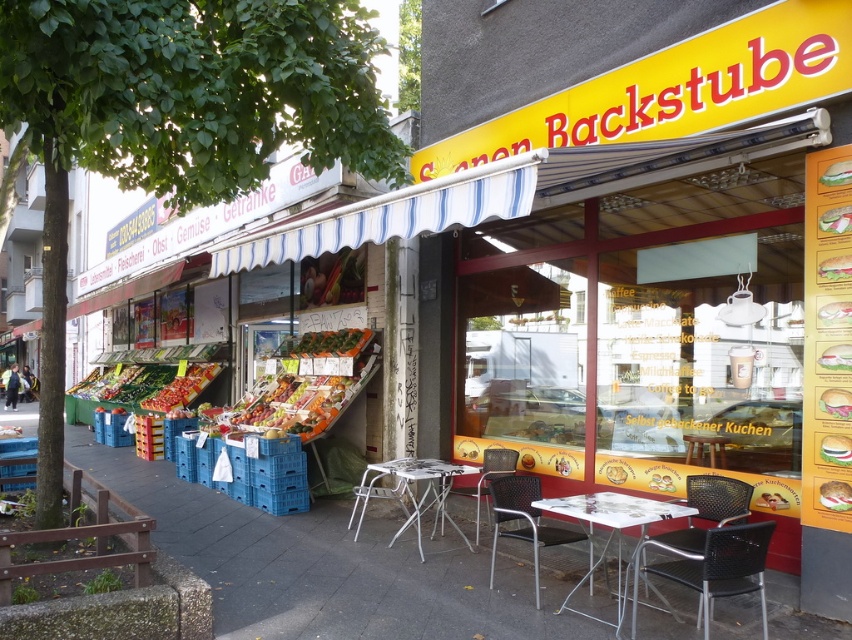
Is point (740, 564) less distant than point (387, 486)?

Yes, point (740, 564) is closer to viewer.

Is black plastic chair at lower right closer to the viewer compared to white plastic table at center?

Yes, black plastic chair at lower right is in front of white plastic table at center.

Between point (735, 532) and point (401, 493), which one is positioned in front?

Point (735, 532)

The image size is (852, 640). I want to click on black plastic chair at lower right, so click(x=714, y=568).

Does smooth concrete pavement at center appear over green matte vegetables at center?

No.

Can you confirm if smooth concrete pavement at center is wider than green matte vegetables at center?

Yes.

What do you see at coordinates (335, 564) in the screenshot?
I see `smooth concrete pavement at center` at bounding box center [335, 564].

This screenshot has width=852, height=640. I want to click on smooth concrete pavement at center, so click(335, 564).

Does smooth concrete pavement at center have a smaller size compared to black plastic chair at lower right?

Actually, smooth concrete pavement at center might be larger than black plastic chair at lower right.

Which is behind, point (338, 566) or point (730, 592)?

The point (338, 566) is more distant.

In order to click on smooth concrete pavement at center in this screenshot , I will do `click(335, 564)`.